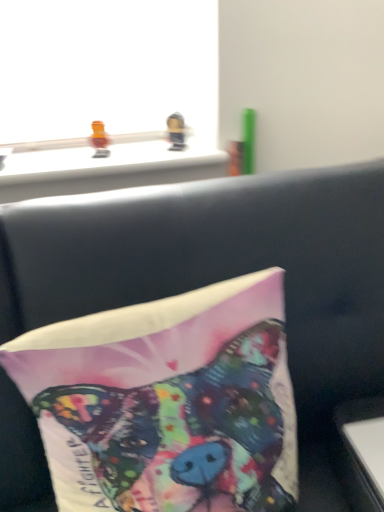
Where is `metallic gold toy at upper center, marked as the 1th toy in a right-to-left arrangement`? This screenshot has height=512, width=384. metallic gold toy at upper center, marked as the 1th toy in a right-to-left arrangement is located at coordinates (176, 132).

What is the approximate height of silky fabric pillow at center?

silky fabric pillow at center is 46.95 centimeters in height.

The width and height of the screenshot is (384, 512). Describe the element at coordinates (362, 451) in the screenshot. I see `white glossy table at lower right` at that location.

Find the location of a particular element. This screenshot has width=384, height=512. metallic gold toy at upper center, marked as the 1th toy in a right-to-left arrangement is located at coordinates (176, 132).

Is metallic gold toy at upper center, the 2th toy positioned from the left, smaller than white glossy table at lower right?

Yes, metallic gold toy at upper center, the 2th toy positioned from the left, is smaller than white glossy table at lower right.

Is the surface of metallic gold toy at upper center, the 2th toy positioned from the left, in direct contact with white glossy table at lower right?

No, metallic gold toy at upper center, the 2th toy positioned from the left, is not touching white glossy table at lower right.

Can you confirm if metallic gold toy at upper center, marked as the 1th toy in a right-to-left arrangement, is thinner than white glossy table at lower right?

Indeed, metallic gold toy at upper center, marked as the 1th toy in a right-to-left arrangement, has a lesser width compared to white glossy table at lower right.

Is translucent orange toy at upper left, arranged as the 2th toy when viewed from the right, positioned far away from metallic gold toy at upper center, marked as the 1th toy in a right-to-left arrangement?

No, there isn't a large distance between translucent orange toy at upper left, arranged as the 2th toy when viewed from the right, and metallic gold toy at upper center, marked as the 1th toy in a right-to-left arrangement.

Can you confirm if translucent orange toy at upper left, the 1th toy viewed from the left, is shorter than metallic gold toy at upper center, marked as the 1th toy in a right-to-left arrangement?

Indeed, translucent orange toy at upper left, the 1th toy viewed from the left, has a lesser height compared to metallic gold toy at upper center, marked as the 1th toy in a right-to-left arrangement.

Is point (91, 135) farther from viewer compared to point (184, 131)?

Yes, point (91, 135) is farther from viewer.

From a real-world perspective, is translucent orange toy at upper left, arranged as the 2th toy when viewed from the right, physically located above or below metallic gold toy at upper center, the 2th toy positioned from the left?

translucent orange toy at upper left, arranged as the 2th toy when viewed from the right, is above metallic gold toy at upper center, the 2th toy positioned from the left.

Based on the photo, how different are the orientations of silky fabric pillow at center and white glossy table at lower right in degrees?

There is a 5.66-degree angle between the facing directions of silky fabric pillow at center and white glossy table at lower right.

Would you say silky fabric pillow at center is to the left or to the right of white glossy table at lower right in the picture?

silky fabric pillow at center is positioned on white glossy table at lower right's left side.

Find the location of `table located underneath the silky fabric pillow at center (from a real-world perspective)`. table located underneath the silky fabric pillow at center (from a real-world perspective) is located at coordinates (362, 451).

From a real-world perspective, which is physically below, silky fabric pillow at center or white glossy table at lower right?

From a 3D spatial view, white glossy table at lower right is below.

From the image's perspective, relative to white glossy table at lower right, is translucent orange toy at upper left, the 1th toy viewed from the left, above or below?

From the image's perspective, translucent orange toy at upper left, the 1th toy viewed from the left, appears above white glossy table at lower right.

Based on their positions, is translucent orange toy at upper left, the 1th toy viewed from the left, located to the left or right of white glossy table at lower right?

In the image, translucent orange toy at upper left, the 1th toy viewed from the left, appears on the left side of white glossy table at lower right.

Between translucent orange toy at upper left, arranged as the 2th toy when viewed from the right, and white glossy table at lower right, which one has smaller size?

translucent orange toy at upper left, arranged as the 2th toy when viewed from the right.

Is metallic gold toy at upper center, the 2th toy positioned from the left, next to silky fabric pillow at center?

metallic gold toy at upper center, the 2th toy positioned from the left, and silky fabric pillow at center are not in contact.

Is metallic gold toy at upper center, the 2th toy positioned from the left, bigger than silky fabric pillow at center?

No, metallic gold toy at upper center, the 2th toy positioned from the left, is not bigger than silky fabric pillow at center.

From their relative heights in the image, would you say metallic gold toy at upper center, the 2th toy positioned from the left, is taller or shorter than silky fabric pillow at center?

In the image, metallic gold toy at upper center, the 2th toy positioned from the left, appears to be shorter than silky fabric pillow at center.

Consider the image. Does metallic gold toy at upper center, the 2th toy positioned from the left, have a greater width compared to silky fabric pillow at center?

In fact, metallic gold toy at upper center, the 2th toy positioned from the left, might be narrower than silky fabric pillow at center.

From a real-world perspective, is white glossy table at lower right beneath metallic gold toy at upper center, the 2th toy positioned from the left?

Yes, from a real-world perspective, white glossy table at lower right is under metallic gold toy at upper center, the 2th toy positioned from the left.

Is white glossy table at lower right located outside metallic gold toy at upper center, the 2th toy positioned from the left?

Absolutely, white glossy table at lower right is external to metallic gold toy at upper center, the 2th toy positioned from the left.

Is there a large distance between white glossy table at lower right and metallic gold toy at upper center, marked as the 1th toy in a right-to-left arrangement?

No.

Which is more to the right, white glossy table at lower right or metallic gold toy at upper center, marked as the 1th toy in a right-to-left arrangement?

white glossy table at lower right.

Who is more distant, translucent orange toy at upper left, arranged as the 2th toy when viewed from the right, or silky fabric pillow at center?

Positioned behind is translucent orange toy at upper left, arranged as the 2th toy when viewed from the right.

From a real-world perspective, relative to silky fabric pillow at center, is translucent orange toy at upper left, arranged as the 2th toy when viewed from the right, vertically above or below?

In terms of real-world spatial position, translucent orange toy at upper left, arranged as the 2th toy when viewed from the right, is above silky fabric pillow at center.

From the image's perspective, is translucent orange toy at upper left, arranged as the 2th toy when viewed from the right, positioned above or below silky fabric pillow at center?

Clearly, from the image's perspective, translucent orange toy at upper left, arranged as the 2th toy when viewed from the right, is above silky fabric pillow at center.

Is the surface of translucent orange toy at upper left, arranged as the 2th toy when viewed from the right, in direct contact with silky fabric pillow at center?

translucent orange toy at upper left, arranged as the 2th toy when viewed from the right, is not next to silky fabric pillow at center, and they're not touching.

Where is `table that appears below the metallic gold toy at upper center, marked as the 1th toy in a right-to-left arrangement (from a real-world perspective)`? The height and width of the screenshot is (512, 384). table that appears below the metallic gold toy at upper center, marked as the 1th toy in a right-to-left arrangement (from a real-world perspective) is located at coordinates 362,451.

You are a GUI agent. You are given a task and a screenshot of the screen. Output one action in this format:
    pyautogui.click(x=<x>, y=<y>)
    Task: Click on the toy behind the translucent orange toy at upper left, the 1th toy viewed from the left
    
    Given the screenshot: What is the action you would take?
    point(176,132)

Based on their spatial positions, is metallic gold toy at upper center, the 2th toy positioned from the left, or silky fabric pillow at center closer to white glossy table at lower right?

silky fabric pillow at center.

Looking at the image, which one is located closer to white glossy table at lower right, silky fabric pillow at center or metallic gold toy at upper center, marked as the 1th toy in a right-to-left arrangement?

silky fabric pillow at center is closer to white glossy table at lower right.

From the image, which object appears to be nearer to white glossy table at lower right, silky fabric pillow at center or translucent orange toy at upper left, the 1th toy viewed from the left?

silky fabric pillow at center lies closer to white glossy table at lower right than the other object.

Based on their spatial positions, is metallic gold toy at upper center, marked as the 1th toy in a right-to-left arrangement, or translucent orange toy at upper left, arranged as the 2th toy when viewed from the right, further from white glossy table at lower right?

Based on the image, translucent orange toy at upper left, arranged as the 2th toy when viewed from the right, appears to be further to white glossy table at lower right.

Based on the photo, from the image, which object appears to be farther from translucent orange toy at upper left, arranged as the 2th toy when viewed from the right, white glossy table at lower right or metallic gold toy at upper center, marked as the 1th toy in a right-to-left arrangement?

white glossy table at lower right.

Looking at the image, which one is located further to metallic gold toy at upper center, the 2th toy positioned from the left, silky fabric pillow at center or white glossy table at lower right?

white glossy table at lower right is positioned further to the anchor metallic gold toy at upper center, the 2th toy positioned from the left.

Based on the photo, considering their positions, is metallic gold toy at upper center, marked as the 1th toy in a right-to-left arrangement, positioned closer to silky fabric pillow at center than translucent orange toy at upper left, the 1th toy viewed from the left?

metallic gold toy at upper center, marked as the 1th toy in a right-to-left arrangement, is positioned closer to the anchor silky fabric pillow at center.

Estimate the real-world distances between objects in this image. Which object is closer to silky fabric pillow at center, white glossy table at lower right or translucent orange toy at upper left, the 1th toy viewed from the left?

white glossy table at lower right is closer to silky fabric pillow at center.

Identify the location of furniture between metallic gold toy at upper center, marked as the 1th toy in a right-to-left arrangement, and white glossy table at lower right, in the vertical direction. (223, 274).

This screenshot has height=512, width=384. In order to click on toy between silky fabric pillow at center and metallic gold toy at upper center, the 2th toy positioned from the left, in the front-back direction in this screenshot , I will do `click(99, 140)`.

Identify the location of toy between metallic gold toy at upper center, the 2th toy positioned from the left, and white glossy table at lower right in the up-down direction. pos(99,140).

The width and height of the screenshot is (384, 512). Identify the location of furniture that lies between translucent orange toy at upper left, arranged as the 2th toy when viewed from the right, and white glossy table at lower right from top to bottom. (223, 274).